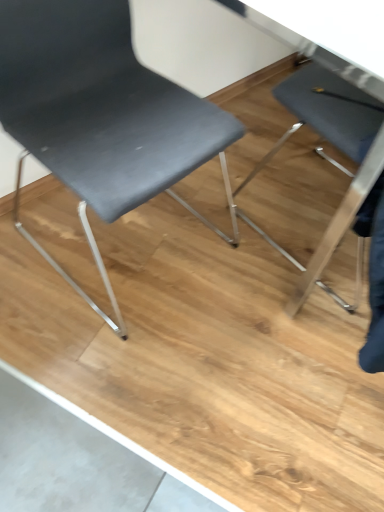
Where is `matte black chair at right, marked as the 1th chair in a right-to-left arrangement`? The image size is (384, 512). matte black chair at right, marked as the 1th chair in a right-to-left arrangement is located at coordinates (337, 147).

Describe the element at coordinates (337, 147) in the screenshot. This screenshot has width=384, height=512. I see `matte black chair at right, which appears as the second chair when viewed from the left` at that location.

Measure the distance between matte black chair at right, which appears as the second chair when viewed from the left, and camera.

matte black chair at right, which appears as the second chair when viewed from the left, is 86.68 centimeters away from camera.

What is the approximate height of matte black chair at left, marked as the first chair in a left-to-right arrangement?

34.71 inches.

What is the approximate width of matte black chair at left, the second chair when ordered from right to left?

It is 23.37 inches.

The width and height of the screenshot is (384, 512). In order to click on matte black chair at left, the second chair when ordered from right to left in this screenshot , I will do `click(101, 116)`.

This screenshot has height=512, width=384. Describe the element at coordinates (101, 116) in the screenshot. I see `matte black chair at left, marked as the first chair in a left-to-right arrangement` at that location.

I want to click on matte black chair at right, which appears as the second chair when viewed from the left, so click(x=337, y=147).

Considering the relative positions of matte black chair at left, the second chair when ordered from right to left, and matte black chair at right, marked as the 1th chair in a right-to-left arrangement, in the image provided, is matte black chair at left, the second chair when ordered from right to left, to the left or to the right of matte black chair at right, marked as the 1th chair in a right-to-left arrangement,?

Based on their positions, matte black chair at left, the second chair when ordered from right to left, is located to the left of matte black chair at right, marked as the 1th chair in a right-to-left arrangement.

Which object is further away from the camera, matte black chair at left, marked as the first chair in a left-to-right arrangement, or matte black chair at right, marked as the 1th chair in a right-to-left arrangement?

matte black chair at right, marked as the 1th chair in a right-to-left arrangement, is more distant.

Considering the points (90, 170) and (380, 113), which point is behind, point (90, 170) or point (380, 113)?

Positioned behind is point (380, 113).

From the image's perspective, is matte black chair at left, marked as the first chair in a left-to-right arrangement, located above or below matte black chair at right, which appears as the second chair when viewed from the left?

Clearly, from the image's perspective, matte black chair at left, marked as the first chair in a left-to-right arrangement, is above matte black chair at right, which appears as the second chair when viewed from the left.

From a real-world perspective, is matte black chair at left, the second chair when ordered from right to left, positioned above or below matte black chair at right, marked as the 1th chair in a right-to-left arrangement?

matte black chair at left, the second chair when ordered from right to left, is above matte black chair at right, marked as the 1th chair in a right-to-left arrangement.

Which of these two, matte black chair at left, marked as the first chair in a left-to-right arrangement, or matte black chair at right, which appears as the second chair when viewed from the left, is wider?

With larger width is matte black chair at left, marked as the first chair in a left-to-right arrangement.

Looking at this image, which of these two, matte black chair at left, marked as the first chair in a left-to-right arrangement, or matte black chair at right, which appears as the second chair when viewed from the left, stands shorter?

With less height is matte black chair at right, which appears as the second chair when viewed from the left.

Considering the relative sizes of matte black chair at left, the second chair when ordered from right to left, and matte black chair at right, which appears as the second chair when viewed from the left, in the image provided, is matte black chair at left, the second chair when ordered from right to left, smaller than matte black chair at right, which appears as the second chair when viewed from the left,?

No.

Would you say matte black chair at left, the second chair when ordered from right to left, is inside or outside matte black chair at right, which appears as the second chair when viewed from the left?

matte black chair at left, the second chair when ordered from right to left, cannot be found inside matte black chair at right, which appears as the second chair when viewed from the left.

Based on the photo, are matte black chair at left, marked as the first chair in a left-to-right arrangement, and matte black chair at right, marked as the 1th chair in a right-to-left arrangement, making contact?

No, matte black chair at left, marked as the first chair in a left-to-right arrangement, is not touching matte black chair at right, marked as the 1th chair in a right-to-left arrangement.

Does matte black chair at left, marked as the first chair in a left-to-right arrangement, turn towards matte black chair at right, marked as the 1th chair in a right-to-left arrangement?

No, matte black chair at left, marked as the first chair in a left-to-right arrangement, is not facing towards matte black chair at right, marked as the 1th chair in a right-to-left arrangement.

How many degrees apart are the facing directions of matte black chair at left, marked as the first chair in a left-to-right arrangement, and matte black chair at right, marked as the 1th chair in a right-to-left arrangement?

176 degrees separate the facing orientations of matte black chair at left, marked as the first chair in a left-to-right arrangement, and matte black chair at right, marked as the 1th chair in a right-to-left arrangement.

In the image, there is a matte black chair at right, which appears as the second chair when viewed from the left. In order to click on chair above it (from the image's perspective) in this screenshot , I will do `click(101, 116)`.

Based on their positions, is matte black chair at right, marked as the 1th chair in a right-to-left arrangement, located to the left or right of matte black chair at left, the second chair when ordered from right to left?

matte black chair at right, marked as the 1th chair in a right-to-left arrangement, is positioned on matte black chair at left, the second chair when ordered from right to left,'s right side.

Between matte black chair at right, marked as the 1th chair in a right-to-left arrangement, and matte black chair at left, the second chair when ordered from right to left, which one is positioned behind?

Positioned behind is matte black chair at right, marked as the 1th chair in a right-to-left arrangement.

Is point (329, 73) behind point (98, 307)?

No, it is not.

From the image's perspective, who appears lower, matte black chair at right, which appears as the second chair when viewed from the left, or matte black chair at left, the second chair when ordered from right to left?

matte black chair at right, which appears as the second chair when viewed from the left, appears lower in the image.

From a real-world perspective, which object stands above the other?

matte black chair at left, marked as the first chair in a left-to-right arrangement, is physically above.

Is matte black chair at right, which appears as the second chair when viewed from the left, thinner than matte black chair at left, the second chair when ordered from right to left?

Indeed, matte black chair at right, which appears as the second chair when viewed from the left, has a lesser width compared to matte black chair at left, the second chair when ordered from right to left.

From the picture: Can you confirm if matte black chair at right, marked as the 1th chair in a right-to-left arrangement, is taller than matte black chair at left, the second chair when ordered from right to left?

In fact, matte black chair at right, marked as the 1th chair in a right-to-left arrangement, may be shorter than matte black chair at left, the second chair when ordered from right to left.

Considering the sizes of objects matte black chair at right, marked as the 1th chair in a right-to-left arrangement, and matte black chair at left, marked as the first chair in a left-to-right arrangement, in the image provided, who is smaller, matte black chair at right, marked as the 1th chair in a right-to-left arrangement, or matte black chair at left, marked as the first chair in a left-to-right arrangement,?

matte black chair at right, marked as the 1th chair in a right-to-left arrangement, is smaller.

Consider the image. Can matte black chair at left, the second chair when ordered from right to left, be found inside matte black chair at right, marked as the 1th chair in a right-to-left arrangement?

No, matte black chair at left, the second chair when ordered from right to left, is not inside matte black chair at right, marked as the 1th chair in a right-to-left arrangement.

Is matte black chair at right, which appears as the second chair when viewed from the left, not close to matte black chair at left, the second chair when ordered from right to left?

matte black chair at right, which appears as the second chair when viewed from the left, is near matte black chair at left, the second chair when ordered from right to left, not far away.

Is matte black chair at right, which appears as the second chair when viewed from the left, positioned with its back to matte black chair at left, marked as the first chair in a left-to-right arrangement?

No.

How different are the orientations of matte black chair at right, marked as the 1th chair in a right-to-left arrangement, and matte black chair at left, marked as the first chair in a left-to-right arrangement, in degrees?

The angular difference between matte black chair at right, marked as the 1th chair in a right-to-left arrangement, and matte black chair at left, marked as the first chair in a left-to-right arrangement, is 176 degrees.

Identify the location of chair that appears above the matte black chair at right, marked as the 1th chair in a right-to-left arrangement (from a real-world perspective). (101, 116).

I want to click on chair on the left of matte black chair at right, which appears as the second chair when viewed from the left, so click(x=101, y=116).

Where is `chair lying above the matte black chair at right, which appears as the second chair when viewed from the left (from the image's perspective)`? chair lying above the matte black chair at right, which appears as the second chair when viewed from the left (from the image's perspective) is located at coordinates (101, 116).